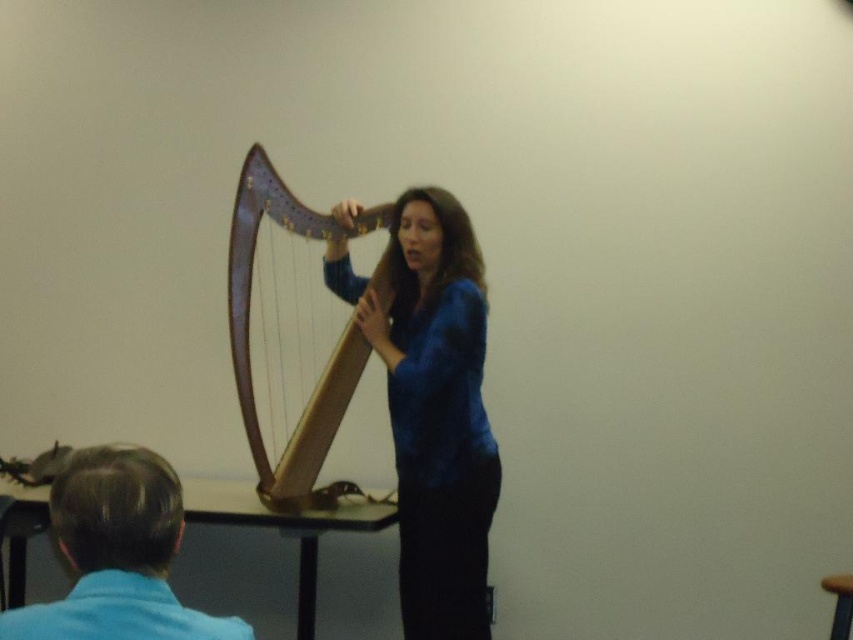
Does velvet blue dress at center have a lesser height compared to blue fabric shirt at lower left?

In fact, velvet blue dress at center may be taller than blue fabric shirt at lower left.

Can you confirm if velvet blue dress at center is smaller than blue fabric shirt at lower left?

No, velvet blue dress at center is not smaller than blue fabric shirt at lower left.

This screenshot has width=853, height=640. What do you see at coordinates (434, 410) in the screenshot?
I see `velvet blue dress at center` at bounding box center [434, 410].

Identify the location of velvet blue dress at center. (434, 410).

Between velvet blue dress at center and wooden harp at center, which one is positioned higher?

Positioned higher is wooden harp at center.

Is point (451, 310) positioned before point (271, 435)?

Yes, it is in front of point (271, 435).

Which is in front, point (398, 563) or point (296, 308)?

Positioned in front is point (398, 563).

Locate an element on the screen. The image size is (853, 640). velvet blue dress at center is located at coordinates (434, 410).

Who is higher up, wooden harp at center or brown wood stool at lower right?

wooden harp at center is above.

Is wooden harp at center thinner than brown wood stool at lower right?

No.

Which is behind, point (257, 228) or point (849, 609)?

Point (257, 228)

The image size is (853, 640). I want to click on wooden harp at center, so click(x=289, y=336).